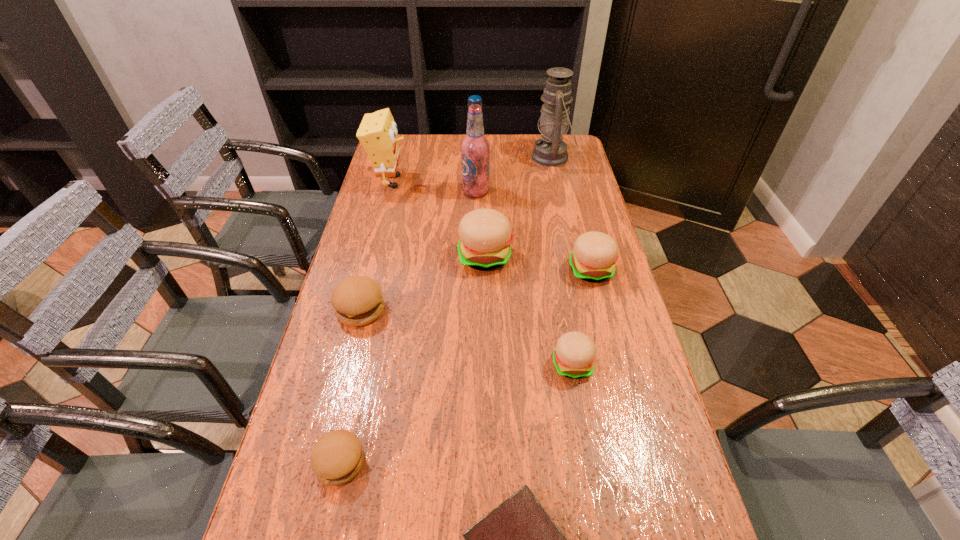
Where is `the nearest beige hamburger`? the nearest beige hamburger is located at coordinates (574, 355).

Image resolution: width=960 pixels, height=540 pixels. I want to click on the seventh farthest object, so click(574, 355).

At what (x,y) coordinates should I click in order to perform the action: click on the smaller brown hamburger. Please return your answer as a coordinate pair (x, y). The height and width of the screenshot is (540, 960). Looking at the image, I should click on (337, 457).

Locate an element on the screen. The height and width of the screenshot is (540, 960). the nearest hamburger is located at coordinates (337, 457).

At what (x,y) coordinates should I click in order to perform the action: click on vacant space situated 0.280m on the left of the oil lamp. Please return your answer as a coordinate pair (x, y). This screenshot has height=540, width=960. Looking at the image, I should click on (460, 157).

Identify the location of blank space located on the front of the blue alcohol. The width and height of the screenshot is (960, 540). (475, 266).

Locate an element on the screen. vacant area located on the face of the yellow sponge is located at coordinates (434, 181).

Locate an element on the screen. The image size is (960, 540). free space located on the front of the fourth tallest object is located at coordinates coord(486,355).

You are a GUI agent. You are given a task and a screenshot of the screen. Output one action in this format:
    pyautogui.click(x=<x>, y=<y>)
    Task: Click on the free space located on the front of the second biggest beige hamburger
    
    Given the screenshot: What is the action you would take?
    pyautogui.click(x=624, y=398)

Identify the location of free location located 0.370m on the back of the sixth farthest object. (386, 212).